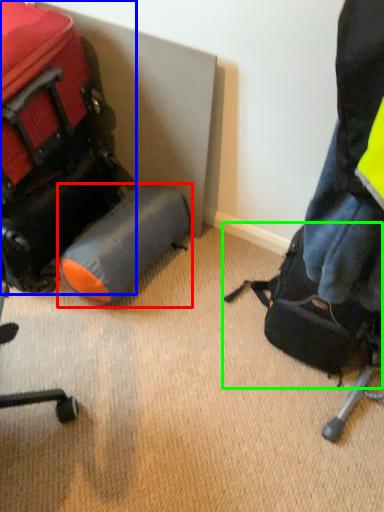
Question: Estimate the real-world distances between objects in this image. Which object is farther from luggage (highlighted by a red box), luggage and bags (highlighted by a blue box) or luggage and bags (highlighted by a green box)?

Choices:
 (A) luggage and bags
 (B) luggage and bags

Answer: (B)